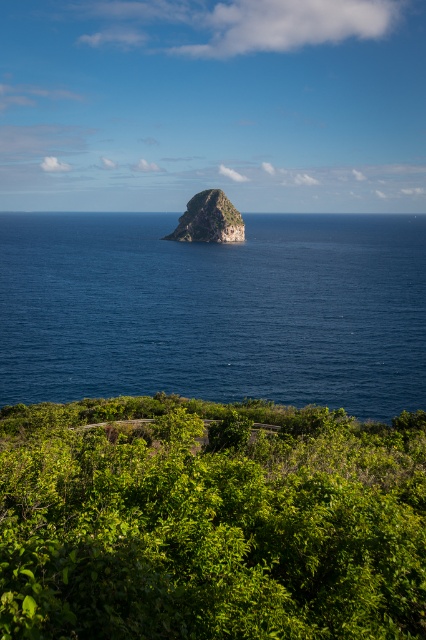
You are standing at the point marked as point (x=210, y=522) in the image. What do you see immediately around you?

Result: You are standing on green leafy shrubs at lower center, as the point (x=210, y=522) is located there.

You are a hiker who wants to cross from the path to the rocky area. The green leafy shrubs at lower center and deep blue water at center are in your way. Which one do you need to go around because it is wider?

The deep blue water at center is wider than the green leafy shrubs at lower center, so you need to go around the deep blue water at center.

You are a hiker standing on the curved pathway near the green leafy shrubs at lower center. You want to reach the deep blue water at center. Which direction should you move to get closer to the water?

The deep blue water at center is taller than the green leafy shrubs at lower center. To reach the deep blue water at center, you should move forward towards the direction where the water is taller than the shrubs.